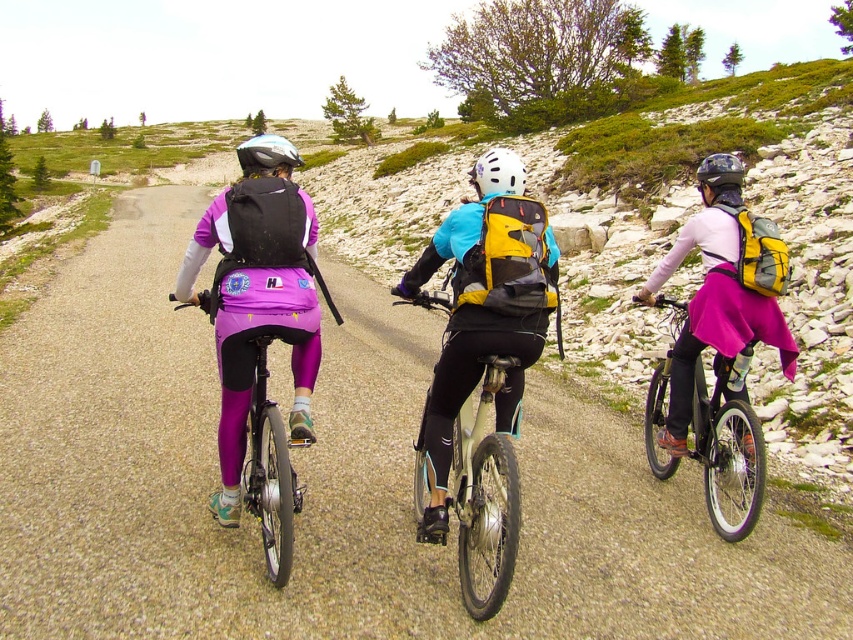
You are a photographer standing at the edge of the gravel path. You want to capture a photo of the matte black bicycle at center and the matte black helmet at center in the same frame. Given that your camera has a maximum focus range of 20 feet, will both objects be in focus?

The matte black bicycle at center and matte black helmet at center are 20.07 feet apart. Since the distance between them exceeds the camera focus range of 20 feet, both objects might not be in focus simultaneously.

You are a photographer trying to capture a clear photo of the matte black backpack at center and the matte black helmet at upper center. Based on their sizes in the image, which object should you focus on first to ensure it fits entirely within the frame?

The matte black backpack at center is shorter than the matte black helmet at upper center, so you should focus on the matte black helmet at upper center first to ensure it fits entirely within the frame since it is taller.

You are a photographer trying to capture a clear shot of the matte black backpack at center and the matte black helmet at upper center. Given their sizes, which object would you need to position your camera closer to in order to ensure both are in focus?

The matte black backpack at center occupies less space than the matte black helmet at upper center, so you would need to position your camera closer to the matte black backpack at center to ensure both are in focus.